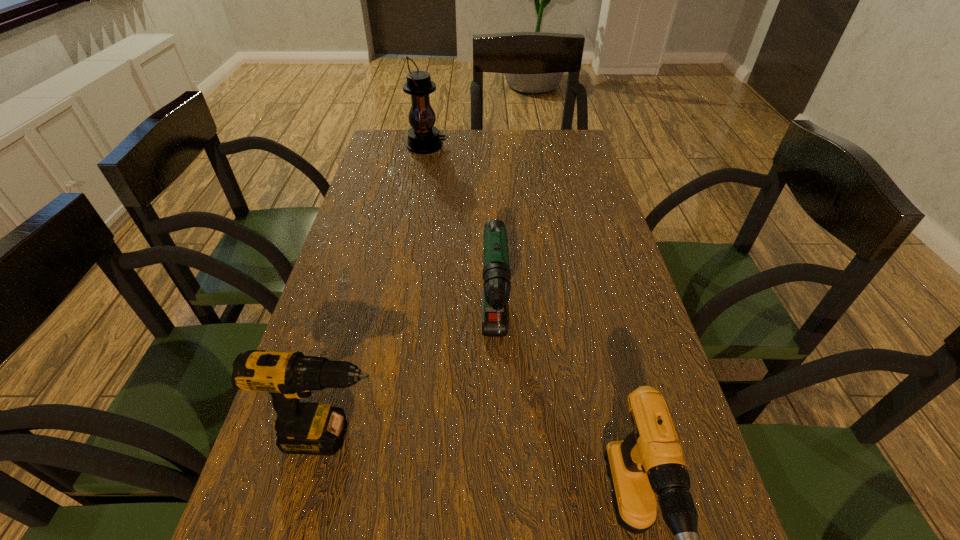
Identify the location of object that can be found as the third closest to the rightmost object. The height and width of the screenshot is (540, 960). (423, 138).

Identify which drill is located as the second nearest to the rightmost object. Please provide its 2D coordinates. Your answer should be formatted as a tuple, i.e. [(x, y)], where the tuple contains the x and y coordinates of a point satisfying the conditions above.

[(307, 428)]

Identify the location of drill object that ranks as the second closest to the leftmost drill. This screenshot has height=540, width=960. (649, 460).

The image size is (960, 540). Identify the location of free location that satisfies the following two spatial constraints: 1. on the handle side of the farthest drill; 2. at the tip of the leftmost drill. (497, 436).

This screenshot has width=960, height=540. What are the coordinates of `free space that satisfies the following two spatial constraints: 1. on the handle side of the second farthest object; 2. at the tip of the leftmost drill` in the screenshot? It's located at (497, 436).